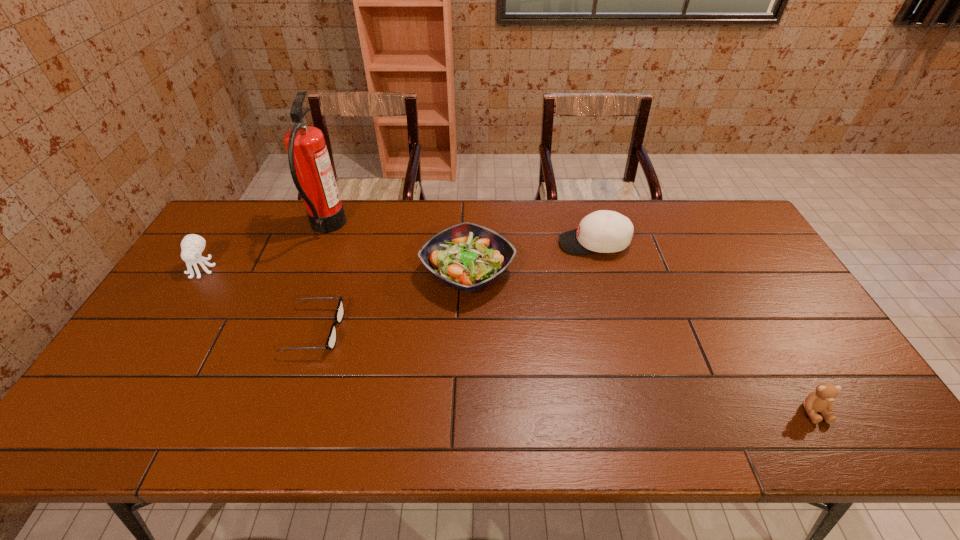
Where is `free spot between the fifth object from left to right and the fourth object from left to right`? The width and height of the screenshot is (960, 540). free spot between the fifth object from left to right and the fourth object from left to right is located at coordinates (531, 258).

You are a GUI agent. You are given a task and a screenshot of the screen. Output one action in this format:
    pyautogui.click(x=<x>, y=<y>)
    Task: Click on the object that can be found as the second closest to the tallest object
    This screenshot has height=540, width=960.
    Given the screenshot: What is the action you would take?
    pyautogui.click(x=331, y=341)

Where is `the second closest object relative to the fifth object from left to right`? This screenshot has height=540, width=960. the second closest object relative to the fifth object from left to right is located at coordinates (821, 400).

Find the location of a particular element. The height and width of the screenshot is (540, 960). vacant position in the image that satisfies the following two spatial constraints: 1. on the back side of the salad plate; 2. on the front-facing side of the fire extinguisher is located at coordinates (469, 228).

Locate an element on the screen. The width and height of the screenshot is (960, 540). free space that satisfies the following two spatial constraints: 1. on the front-facing side of the fire extinguisher; 2. on the front-facing side of the octopus is located at coordinates (311, 268).

Where is `vacant point that satisfies the following two spatial constraints: 1. on the front-facing side of the second object from right to left; 2. on the front-facing side of the leftmost object`? The image size is (960, 540). vacant point that satisfies the following two spatial constraints: 1. on the front-facing side of the second object from right to left; 2. on the front-facing side of the leftmost object is located at coordinates (601, 268).

At what (x,y) coordinates should I click in order to perform the action: click on vacant area in the image that satisfies the following two spatial constraints: 1. on the front side of the salad plate; 2. on the front-facing side of the spectacles. Please return your answer as a coordinate pair (x, y). Looking at the image, I should click on (467, 330).

Find the location of `vacant space that satisfies the following two spatial constraints: 1. on the front-facing side of the baseball cap; 2. on the front-facing side of the leftmost object`. vacant space that satisfies the following two spatial constraints: 1. on the front-facing side of the baseball cap; 2. on the front-facing side of the leftmost object is located at coordinates (601, 268).

This screenshot has height=540, width=960. What are the coordinates of `blank area in the image that satisfies the following two spatial constraints: 1. on the front-facing side of the tallest object; 2. on the right side of the salad plate` in the screenshot? It's located at (310, 271).